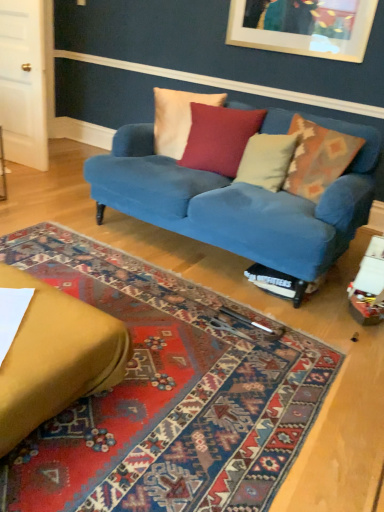
Where is `empty space that is to the right of velvet yellow studio couch at lower left, which ranks as the second studio couch in back-to-front order`? empty space that is to the right of velvet yellow studio couch at lower left, which ranks as the second studio couch in back-to-front order is located at coordinates (181, 408).